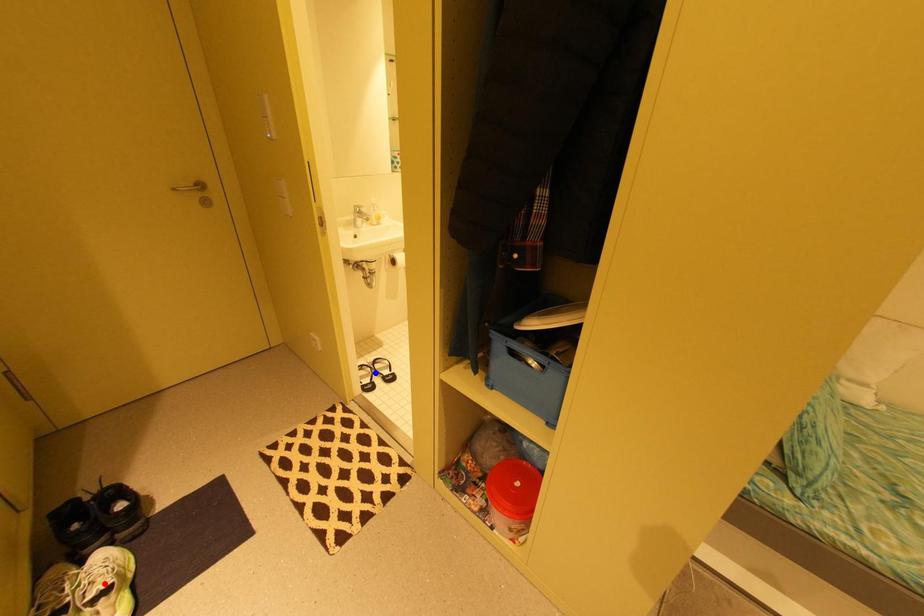
Question: In the image, two points are highlighted. Which point is nearer to the camera? Reply with the corresponding letter.

Choices:
 (A) blue point
 (B) red point

Answer: (B)